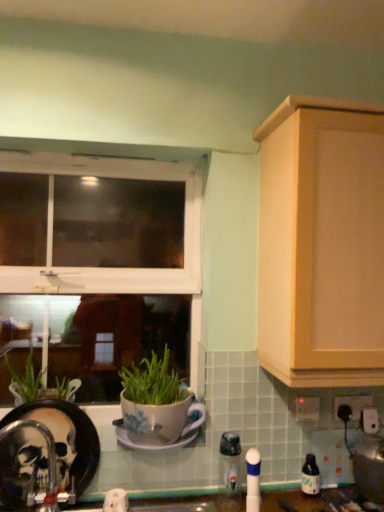
Describe the element at coordinates (38, 384) in the screenshot. I see `green matte plant pot at left` at that location.

The image size is (384, 512). What do you see at coordinates (320, 239) in the screenshot?
I see `light wood cabinet at upper right` at bounding box center [320, 239].

Measure the distance between white plastic window at upper left and camera.

white plastic window at upper left and camera are 1.52 meters apart.

Describe the element at coordinates (369, 468) in the screenshot. I see `metallic silver toaster at lower right, placed as the 2th appliance when sorted from left to right` at that location.

Image resolution: width=384 pixels, height=512 pixels. What are the coordinates of `green matte plant pot at left` in the screenshot? It's located at (38, 384).

Which of these two, white plastic window at upper left or white plastic electric outlet at lower right, the 1th electric outlet when ordered from right to left, is bigger?

Bigger between the two is white plastic window at upper left.

Does white plastic window at upper left touch white plastic electric outlet at lower right, the 1th electric outlet when ordered from right to left?

No, white plastic window at upper left is not touching white plastic electric outlet at lower right, the 1th electric outlet when ordered from right to left.

Does point (131, 166) appear closer or farther from the camera than point (356, 403)?

Point (131, 166) appears to be farther away from the viewer than point (356, 403).

Is metallic silver toaster at lower right, placed as the 2th appliance when sorted from left to right, further to the viewer compared to light wood cabinet at upper right?

Yes, metallic silver toaster at lower right, placed as the 2th appliance when sorted from left to right, is further from the viewer.

Considering the positions of objects metallic silver toaster at lower right, placed as the 2th appliance when sorted from left to right, and light wood cabinet at upper right in the image provided, who is more to the right, metallic silver toaster at lower right, placed as the 2th appliance when sorted from left to right, or light wood cabinet at upper right?

→ metallic silver toaster at lower right, placed as the 2th appliance when sorted from left to right, is more to the right.

From a real-world perspective, relative to light wood cabinet at upper right, is metallic silver toaster at lower right, the 1th appliance when ordered from right to left, vertically above or below?

Clearly, from a real-world perspective, metallic silver toaster at lower right, the 1th appliance when ordered from right to left, is below light wood cabinet at upper right.

Is metallic silver toaster at lower right, the 1th appliance when ordered from right to left, looking in the opposite direction of light wood cabinet at upper right?

No, light wood cabinet at upper right is not at the back of metallic silver toaster at lower right, the 1th appliance when ordered from right to left.

Which is correct: metallic silver toaster at lower right, placed as the 2th appliance when sorted from left to right, is inside white plastic electric outlet at lower right, the 1th electric outlet when ordered from right to left, or outside of it?

metallic silver toaster at lower right, placed as the 2th appliance when sorted from left to right, is outside white plastic electric outlet at lower right, the 1th electric outlet when ordered from right to left.

Does point (382, 444) come farther from viewer compared to point (345, 398)?

No.

Who is taller, metallic silver toaster at lower right, placed as the 2th appliance when sorted from left to right, or white plastic electric outlet at lower right, which is the 2th electric outlet in left-to-right order?

metallic silver toaster at lower right, placed as the 2th appliance when sorted from left to right.

Is metallic silver toaster at lower right, the 1th appliance when ordered from right to left, oriented away from white plastic electric outlet at lower right, the 1th electric outlet when ordered from right to left?

No.

Which of these two, white plastic electric outlet at upper right, the first electric outlet when ordered from left to right, or green matte plant pot at left, is smaller?

white plastic electric outlet at upper right, the first electric outlet when ordered from left to right, is smaller.

Is point (302, 408) more distant than point (67, 377)?

No, (302, 408) is closer to viewer.

Between white plastic electric outlet at upper right, arranged as the 2th electric outlet when viewed from the right, and green matte plant pot at left, which one has less height?

→ white plastic electric outlet at upper right, arranged as the 2th electric outlet when viewed from the right.

From the image's perspective, is white plastic electric outlet at upper right, the first electric outlet when ordered from left to right, on green matte plant pot at left?

Actually, white plastic electric outlet at upper right, the first electric outlet when ordered from left to right, appears below green matte plant pot at left in the image.

Which object is thinner, white plastic window at upper left or white ceramic saucer at center?

Thinner between the two is white plastic window at upper left.

The height and width of the screenshot is (512, 384). Find the location of `saucer on the right of white plastic window at upper left`. saucer on the right of white plastic window at upper left is located at coordinates click(149, 443).

Is white plastic window at upper left taller or shorter than white ceramic saucer at center?

In the image, white plastic window at upper left appears to be taller than white ceramic saucer at center.

From a real-world perspective, which is physically above, white plastic window at upper left or white ceramic saucer at center?

white plastic window at upper left.

Is translucent plastic soap dispenser at lower center, the 1th appliance from the left, positioned with its back to white plastic electric outlet at lower right, which is the 2th electric outlet in left-to-right order?

No, white plastic electric outlet at lower right, which is the 2th electric outlet in left-to-right order, is not at the back of translucent plastic soap dispenser at lower center, the 1th appliance from the left.

How much distance is there between translucent plastic soap dispenser at lower center, the 1th appliance from the left, and white plastic electric outlet at lower right, which is the 2th electric outlet in left-to-right order?

translucent plastic soap dispenser at lower center, the 1th appliance from the left, is 17.54 inches away from white plastic electric outlet at lower right, which is the 2th electric outlet in left-to-right order.

From a real-world perspective, is translucent plastic soap dispenser at lower center, acting as the 2th appliance starting from the right, below white plastic electric outlet at lower right, which is the 2th electric outlet in left-to-right order?

Yes, from a real-world perspective, translucent plastic soap dispenser at lower center, acting as the 2th appliance starting from the right, is below white plastic electric outlet at lower right, which is the 2th electric outlet in left-to-right order.

Starting from the translucent plastic soap dispenser at lower center, acting as the 2th appliance starting from the right, which electric outlet is the 2nd one to the right? Please provide its 2D coordinates.

[(353, 404)]

From the picture: Looking at the image, does green matte plant pot at left seem bigger or smaller compared to white plastic electric outlet at upper right, arranged as the 2th electric outlet when viewed from the right?

Clearly, green matte plant pot at left is larger in size than white plastic electric outlet at upper right, arranged as the 2th electric outlet when viewed from the right.

In terms of width, does green matte plant pot at left look wider or thinner when compared to white plastic electric outlet at upper right, arranged as the 2th electric outlet when viewed from the right?

green matte plant pot at left is wider than white plastic electric outlet at upper right, arranged as the 2th electric outlet when viewed from the right.

Is green matte plant pot at left completely or partially outside of white plastic electric outlet at upper right, arranged as the 2th electric outlet when viewed from the right?

Yes.

In the image, is green matte plant pot at left positioned in front of or behind white plastic electric outlet at upper right, arranged as the 2th electric outlet when viewed from the right?

Clearly, green matte plant pot at left is in front of white plastic electric outlet at upper right, arranged as the 2th electric outlet when viewed from the right.

I want to click on window lying in front of the white plastic electric outlet at lower right, the 1th electric outlet when ordered from right to left, so click(116, 268).

Where is `the 1st appliance below when counting from the light wood cabinet at upper right (from the image's perspective)`? This screenshot has width=384, height=512. the 1st appliance below when counting from the light wood cabinet at upper right (from the image's perspective) is located at coordinates (369, 468).

From the picture: Considering their positions, is translucent plastic soap dispenser at lower center, acting as the 2th appliance starting from the right, positioned further to white ceramic saucer at center than white plastic electric outlet at lower right, the 1th electric outlet when ordered from right to left?

Among the two, white plastic electric outlet at lower right, the 1th electric outlet when ordered from right to left, is located further to white ceramic saucer at center.

Considering their positions, is translucent plastic soap dispenser at lower center, the 1th appliance from the left, positioned closer to green matte plant pot at left than white plastic electric outlet at upper right, the first electric outlet when ordered from left to right?

translucent plastic soap dispenser at lower center, the 1th appliance from the left, lies closer to green matte plant pot at left than the other object.

Consider the image. Estimate the real-world distances between objects in this image. Which object is further from metallic silver toaster at lower right, the 1th appliance when ordered from right to left, white ceramic saucer at center or green matte plant pot at left?

The object further to metallic silver toaster at lower right, the 1th appliance when ordered from right to left, is green matte plant pot at left.

Which object lies nearer to the anchor point transparent plastic bottle at lower right, white ceramic saucer at center or light wood cabinet at upper right?

white ceramic saucer at center lies closer to transparent plastic bottle at lower right than the other object.

Based on their spatial positions, is green matte plant pot at left or translucent plastic soap dispenser at lower center, the 1th appliance from the left, closer to white ceramic saucer at center?

translucent plastic soap dispenser at lower center, the 1th appliance from the left, is positioned closer to the anchor white ceramic saucer at center.

Considering their positions, is white ceramic saucer at center positioned further to white plastic electric outlet at lower right, which is the 2th electric outlet in left-to-right order, than white plastic electric outlet at upper right, arranged as the 2th electric outlet when viewed from the right?

white ceramic saucer at center is further to white plastic electric outlet at lower right, which is the 2th electric outlet in left-to-right order.

Looking at the image, which one is located closer to translucent plastic soap dispenser at lower center, acting as the 2th appliance starting from the right, transparent plastic bottle at lower right or white ceramic saucer at center?

The object closer to translucent plastic soap dispenser at lower center, acting as the 2th appliance starting from the right, is white ceramic saucer at center.

From the image, which object appears to be nearer to white plastic electric outlet at lower right, which is the 2th electric outlet in left-to-right order, white plastic electric outlet at upper right, the first electric outlet when ordered from left to right, or green matte plant pot at left?

Based on the image, white plastic electric outlet at upper right, the first electric outlet when ordered from left to right, appears to be nearer to white plastic electric outlet at lower right, which is the 2th electric outlet in left-to-right order.

I want to click on cabinetry between brushed metal faucet at lower left and metallic silver toaster at lower right, placed as the 2th appliance when sorted from left to right, in the horizontal direction, so click(320, 239).

Where is `saucer between white plastic window at upper left and white plastic electric outlet at lower right, the 1th electric outlet when ordered from right to left, in the horizontal direction`? saucer between white plastic window at upper left and white plastic electric outlet at lower right, the 1th electric outlet when ordered from right to left, in the horizontal direction is located at coordinates (149, 443).

Image resolution: width=384 pixels, height=512 pixels. Find the location of `saucer between green matte plant pot at left and metallic silver toaster at lower right, the 1th appliance when ordered from right to left, from left to right`. saucer between green matte plant pot at left and metallic silver toaster at lower right, the 1th appliance when ordered from right to left, from left to right is located at coordinates (149, 443).

Locate an element on the screen. Image resolution: width=384 pixels, height=512 pixels. electric outlet that lies between white plastic electric outlet at upper right, arranged as the 2th electric outlet when viewed from the right, and transparent plastic bottle at lower right from top to bottom is located at coordinates (353, 404).